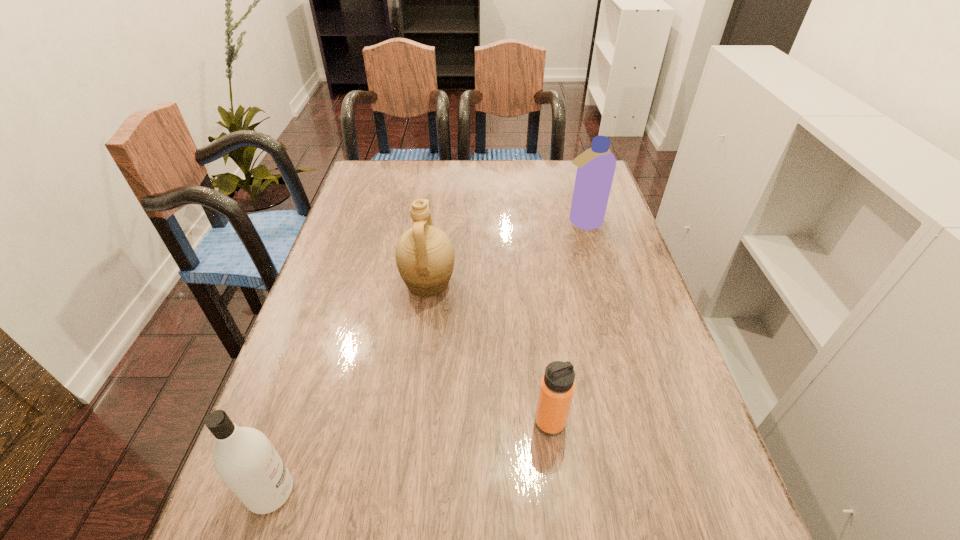
I want to click on vacant area that lies between the third object from left to right and the left shampoo, so click(411, 457).

This screenshot has height=540, width=960. Identify the location of empty space that is in between the nearer shampoo and the second object from left to right. (349, 388).

Image resolution: width=960 pixels, height=540 pixels. What are the coordinates of `free area in between the thermos bottle and the leftmost object` in the screenshot? It's located at (411, 457).

Locate an element on the screen. The image size is (960, 540). vacant space that is in between the second object from right to left and the rightmost object is located at coordinates (566, 322).

At what (x,y) coordinates should I click in order to perform the action: click on empty location between the rightmost object and the leftmost object. Please return your answer as a coordinate pair (x, y). Looking at the image, I should click on (426, 357).

Find the location of a particular element. free space between the farthest object and the third farthest object is located at coordinates (566, 322).

I want to click on empty space between the second object from right to left and the rightmost object, so click(566, 322).

Locate an element on the screen. The width and height of the screenshot is (960, 540). free space between the third nearest object and the third object from left to right is located at coordinates (489, 353).

Identify which object is the nearest to the nearer shampoo. Please provide its 2D coordinates. Your answer should be formatted as a tuple, i.e. [(x, y)], where the tuple contains the x and y coordinates of a point satisfying the conditions above.

[(424, 254)]

Select which object is the third closest to the third farthest object. Please provide its 2D coordinates. Your answer should be formatted as a tuple, i.e. [(x, y)], where the tuple contains the x and y coordinates of a point satisfying the conditions above.

[(596, 166)]